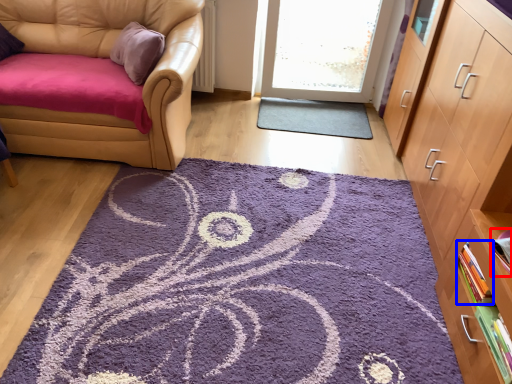
Question: Which point is closer to the camera, book (highlighted by a red box) or book (highlighted by a blue box)?

Choices:
 (A) book
 (B) book

Answer: (A)